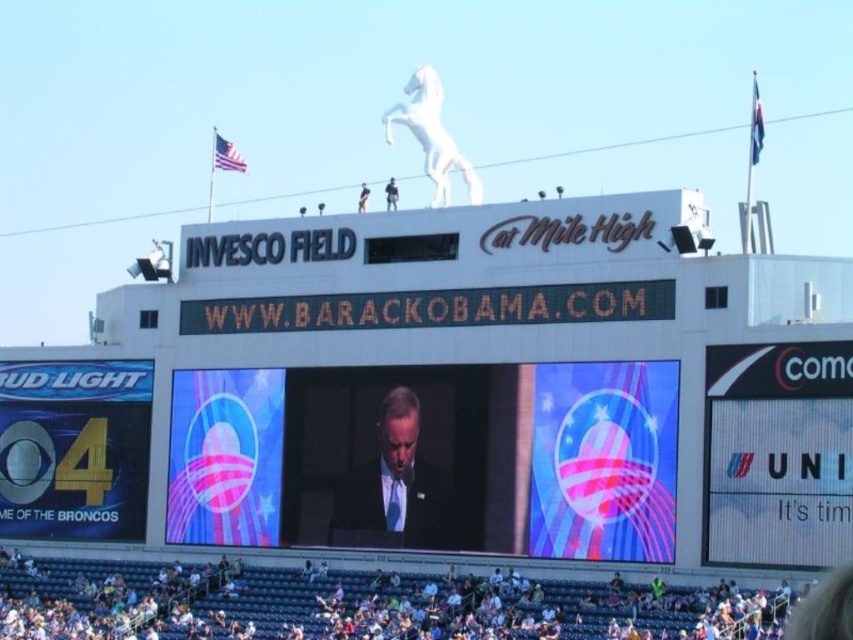
Question: Which point is farther to the camera?

Choices:
 (A) shiny digital display at center
 (B) white fabric crowd at lower center

Answer: (A)

Question: Does white fabric crowd at lower center come behind dark suit at center?

Choices:
 (A) no
 (B) yes

Answer: (A)

Question: Considering the real-world distances, which object is farthest from the white fabric crowd at lower center?

Choices:
 (A) dark suit at center
 (B) shiny digital display at center

Answer: (A)

Question: Does shiny digital display at center have a smaller size compared to dark suit at center?

Choices:
 (A) yes
 (B) no

Answer: (B)

Question: Among these points, which one is nearest to the camera?

Choices:
 (A) (383, 449)
 (B) (415, 547)

Answer: (B)

Question: Is shiny digital display at center thinner than dark suit at center?

Choices:
 (A) yes
 (B) no

Answer: (B)